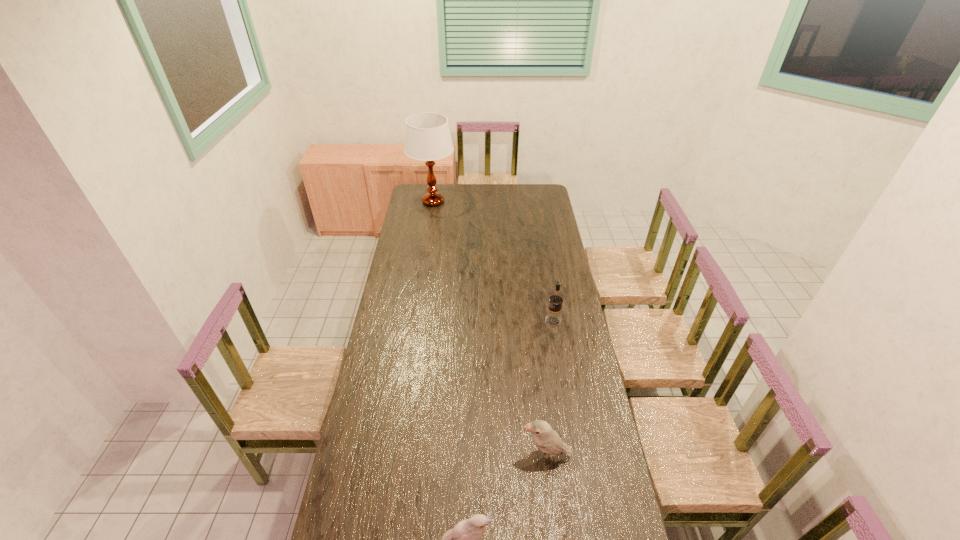
In order to click on free space located at the face of the second nearest object in this screenshot , I will do `click(429, 456)`.

Identify the location of free space located 0.370m at the face of the second nearest object. (416, 456).

You are a GUI agent. You are given a task and a screenshot of the screen. Output one action in this format:
    pyautogui.click(x=<x>, y=<y>)
    Task: Click on the object present at the far edge
    The image size is (960, 540).
    Given the screenshot: What is the action you would take?
    pyautogui.click(x=428, y=138)

This screenshot has width=960, height=540. Identify the location of object that is positioned at the left edge. (428, 138).

Find the location of a particular element. This screenshot has width=960, height=540. vodka present at the right edge is located at coordinates (553, 317).

This screenshot has height=540, width=960. What are the coordinates of `bird that is at the right edge` in the screenshot? It's located at (547, 440).

What are the coordinates of `object located in the far left corner section of the desktop` in the screenshot? It's located at (428, 138).

Where is `vacant space at the far edge of the desktop`? This screenshot has width=960, height=540. vacant space at the far edge of the desktop is located at coordinates (450, 197).

The height and width of the screenshot is (540, 960). In order to click on free space at the left edge in this screenshot , I will do `click(396, 300)`.

The height and width of the screenshot is (540, 960). What are the coordinates of `blank space at the right edge of the desktop` in the screenshot? It's located at (596, 420).